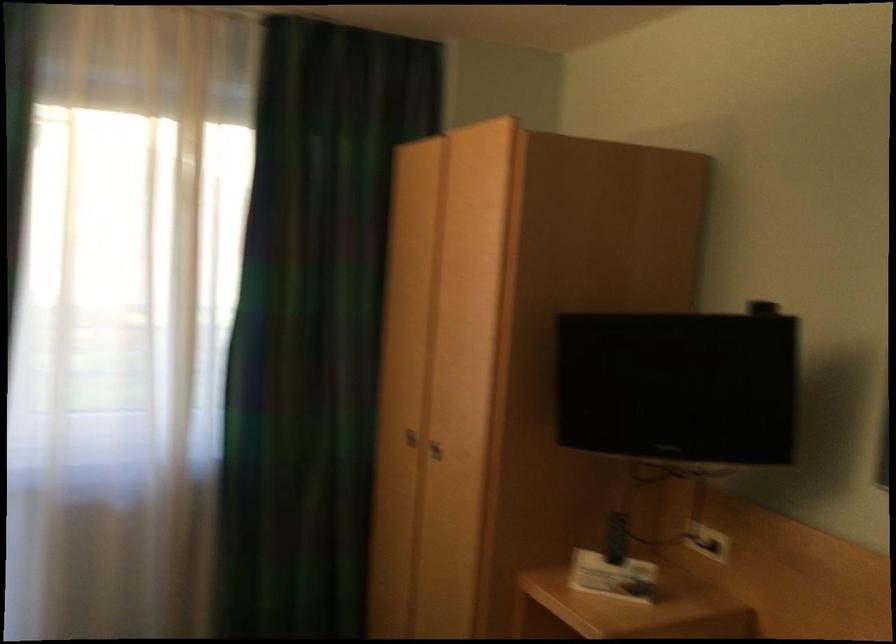
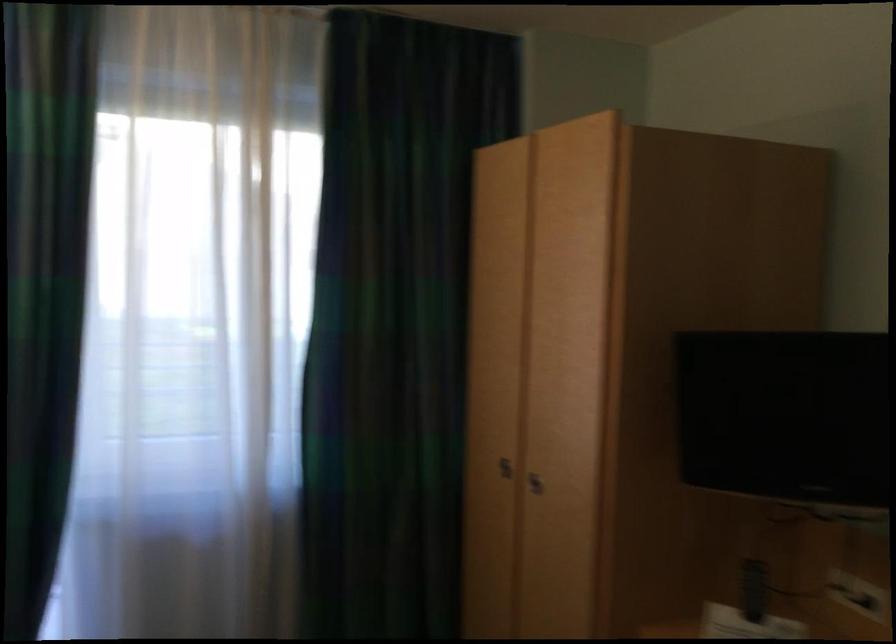
The point at [621,545] is marked in the first image. Where is the corresponding point in the second image?

(754, 589)